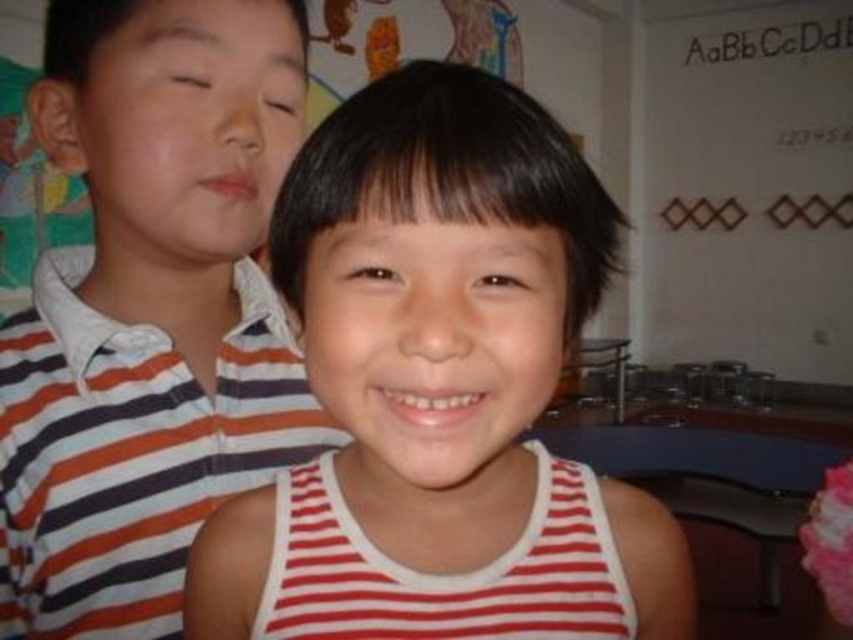
Who is more forward, (42, 256) or (393, 408)?

Point (393, 408)

Locate an element on the screen. The height and width of the screenshot is (640, 853). striped cotton shirt at upper left is located at coordinates (149, 310).